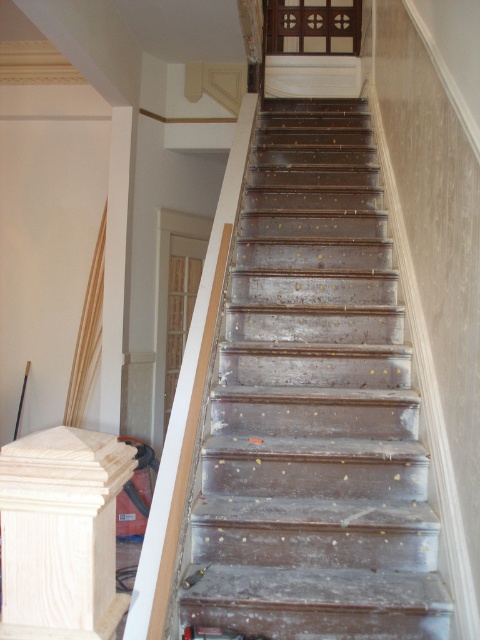
Is wooden stairs at center thinner than unfinished wood post at left?

Incorrect, wooden stairs at center's width is not less than unfinished wood post at left's.

Can you confirm if wooden stairs at center is wider than unfinished wood post at left?

Yes, wooden stairs at center is wider than unfinished wood post at left.

Locate an element on the screen. The height and width of the screenshot is (640, 480). wooden stairs at center is located at coordinates (313, 406).